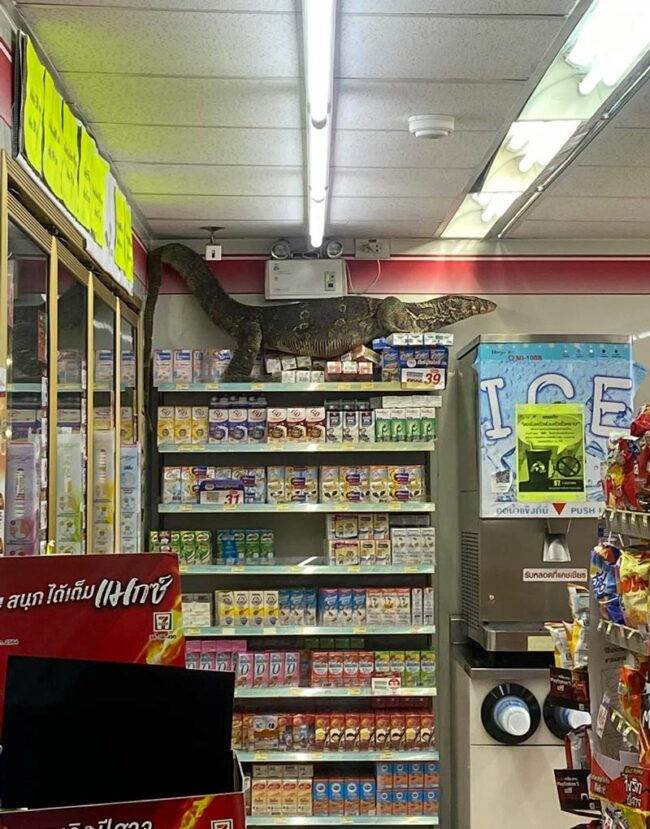
You are a GUI agent. You are given a task and a screenshot of the screen. Output one action in this format:
    pyautogui.click(x=<x>, y=<y>)
    Task: Click on the black poster card
    
    Given the screenshot: What is the action you would take?
    pyautogui.click(x=108, y=708)